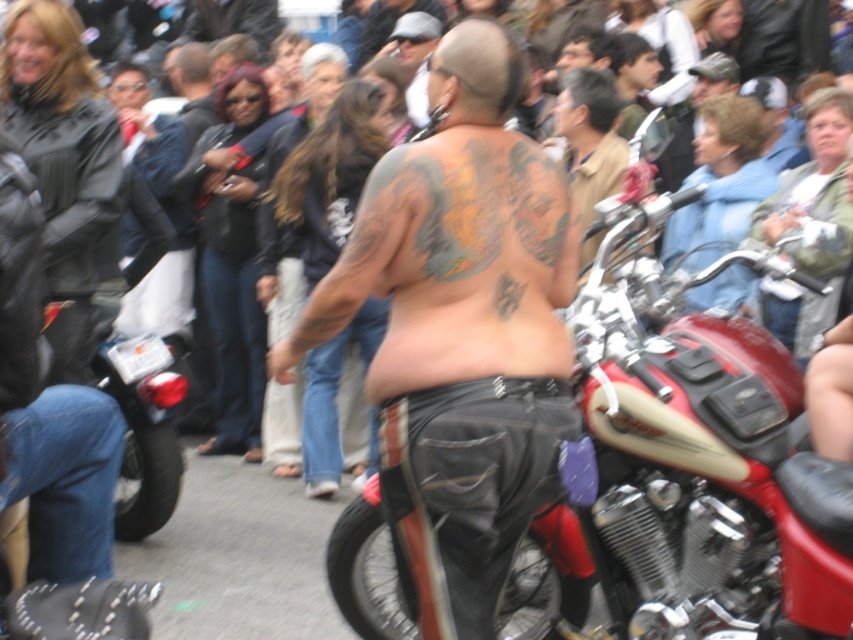
You are standing in the crowd at the motorcycle event and want to take a photo of the shirtless man with the large tattoo on his back. The camera you have can focus on objects up to 4 meters away. Is the point where the shirtless man is standing, located at point (595, 337), within the camera focus range?

The distance of point (595, 337) from the viewer is 3.54 meters. Since the camera can focus up to 4 meters away, the shirtless man at point (595, 337) is within the camera focus range.

Please provide the 2D coordinates of the shiny chrome motorcycle at center in the image. The coordinates should be in the format of a point with two decimal places, like this example format, but do not include any other information. The answer should be the coordinates only, formatted as a point with two decimal places, such as 0.727, 0.798.

(x=680, y=465)